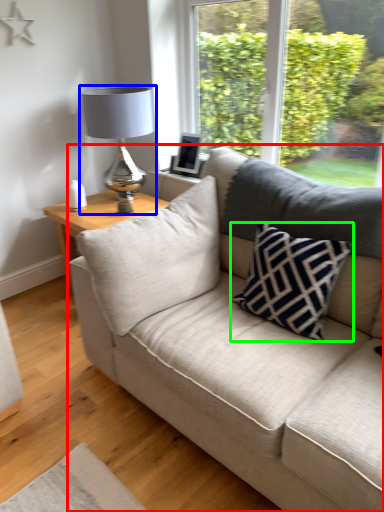
Question: Which object is positioned closest to studio couch (highlighted by a red box)? Select from table lamp (highlighted by a blue box) and pillow (highlighted by a green box).

Choices:
 (A) table lamp
 (B) pillow

Answer: (B)